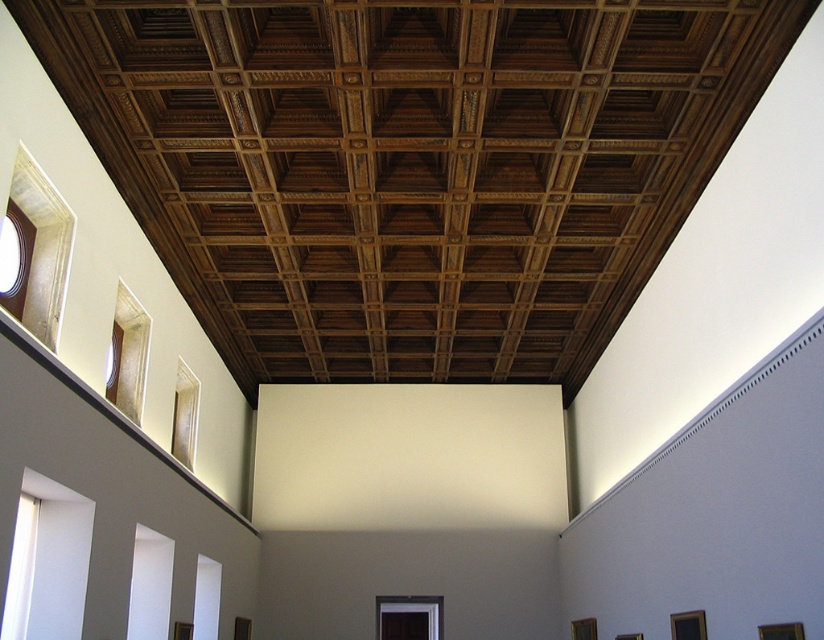
Question: Among these objects, which one is farthest from the camera?

Choices:
 (A) matte white frame at upper left
 (B) matte glass window at center
 (C) clear glass window at upper center
 (D) white glossy window at lower left

Answer: (B)

Question: Can you confirm if matte white frame at upper left is positioned to the left of white matte window at lower center?

Choices:
 (A) no
 (B) yes

Answer: (B)

Question: Which object appears closest to the camera in this image?

Choices:
 (A) transparent glass window at lower right
 (B) transparent glass window at lower center

Answer: (A)

Question: Which object appears closest to the camera in this image?

Choices:
 (A) matte glass window at center
 (B) transparent glass window at lower center
 (C) white glossy window at lower left

Answer: (C)

Question: Observing the image, what is the correct spatial positioning of clear glass window at upper center in reference to white matte window at lower center?

Choices:
 (A) left
 (B) right

Answer: (A)

Question: Can you confirm if matte white frame at upper left is positioned to the left of matte glass window at center?

Choices:
 (A) yes
 (B) no

Answer: (A)